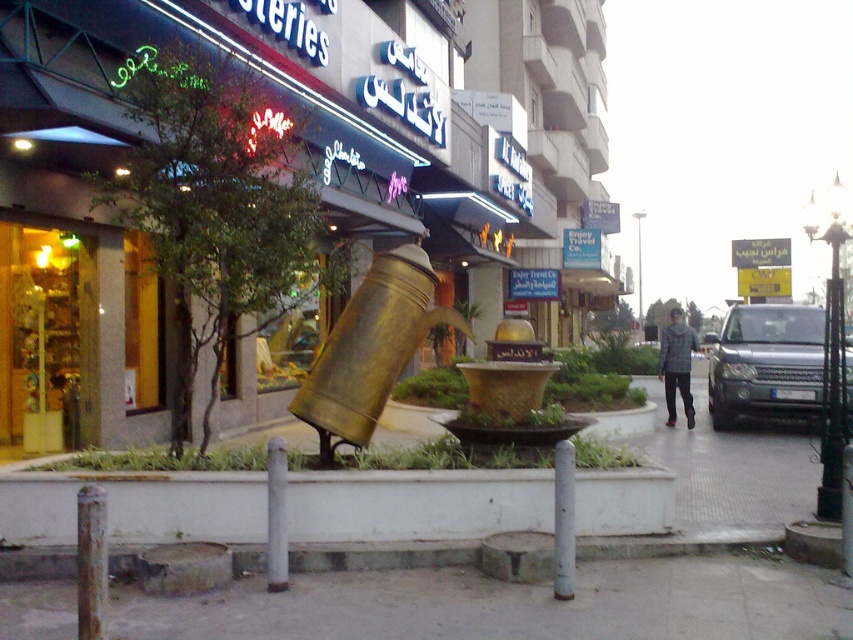
Question: Can you confirm if white concrete planter at lower center is positioned above gold metallic watering can at center?

Choices:
 (A) no
 (B) yes

Answer: (A)

Question: Which point is farther to the camera?

Choices:
 (A) (16, 321)
 (B) (544, 481)
 (C) (793, 324)

Answer: (C)

Question: Where is gray concrete pavement at lower center located in relation to gold metallic watering can at center in the image?

Choices:
 (A) right
 (B) left

Answer: (A)

Question: Observing the image, what is the correct spatial positioning of gold metallic teapot at center in reference to gray concrete pavement at lower center?

Choices:
 (A) below
 (B) above

Answer: (B)

Question: Which point is closer to the camera?

Choices:
 (A) white concrete planter at lower center
 (B) silver metallic suv at right

Answer: (A)

Question: Among these objects, which one is farthest from the camera?

Choices:
 (A) gray concrete pavement at lower center
 (B) gold metallic watering can at center

Answer: (B)